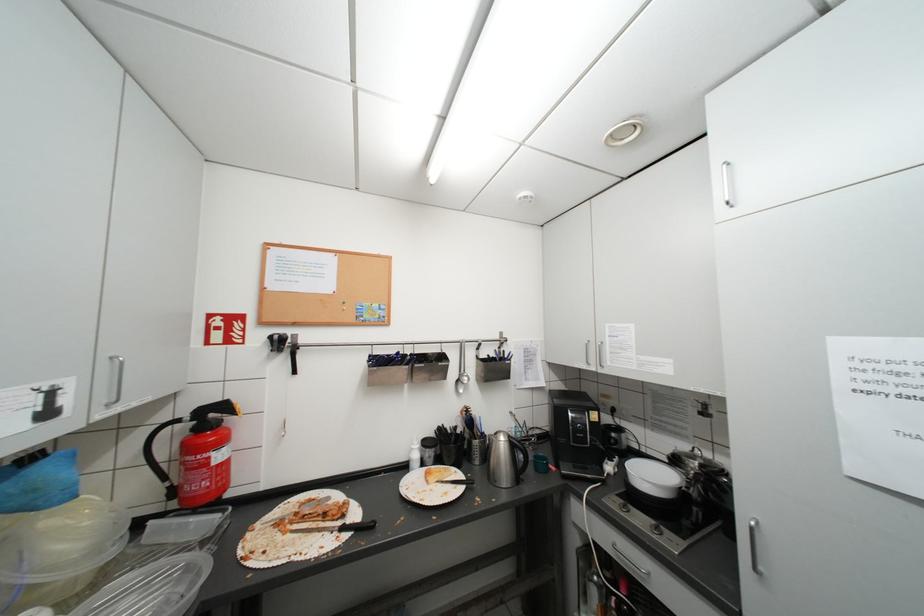
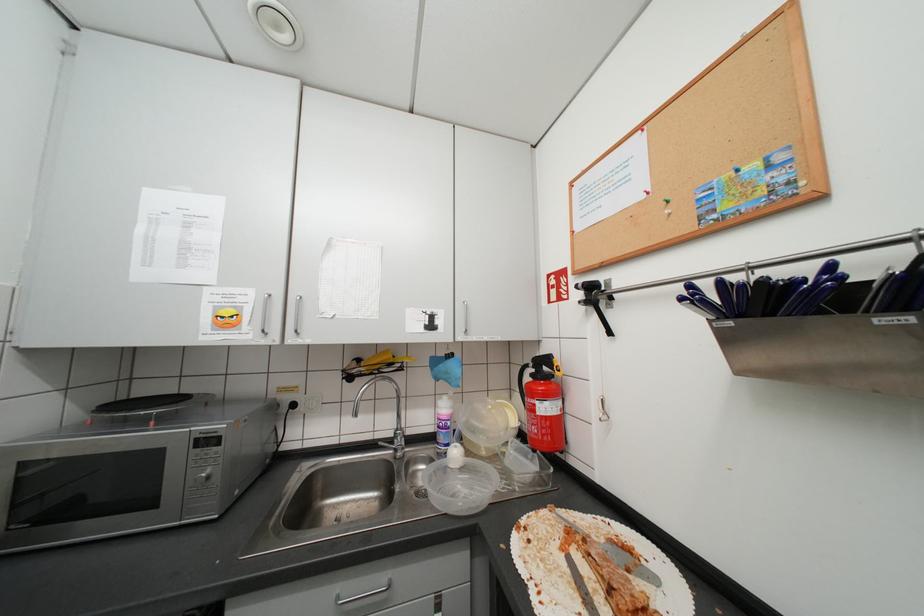
Question: The first image is from the beginning of the video and the second image is from the end. How did the camera likely rotate when shooting the video?

Choices:
 (A) Left
 (B) Right
 (C) Up
 (D) Down

Answer: (A)